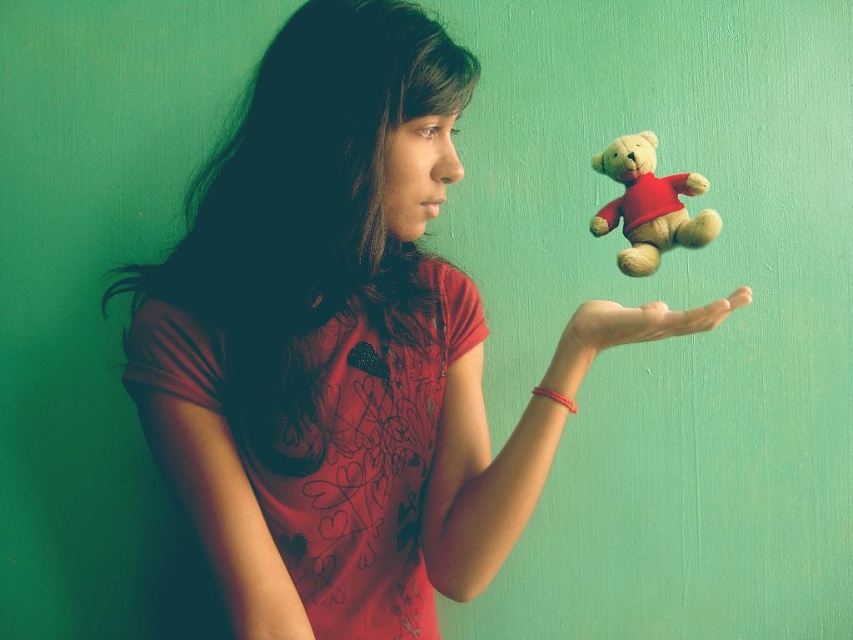
Between velvet beige teddy bear at center and matte skin hand at center, which one has less height?

matte skin hand at center is shorter.

Describe the element at coordinates (648, 205) in the screenshot. The height and width of the screenshot is (640, 853). I see `velvet beige teddy bear at center` at that location.

You are a GUI agent. You are given a task and a screenshot of the screen. Output one action in this format:
    pyautogui.click(x=<x>, y=<y>)
    Task: Click on the velvet beige teddy bear at center
    
    Given the screenshot: What is the action you would take?
    pyautogui.click(x=648, y=205)

Where is `velvet beige teddy bear at center`? velvet beige teddy bear at center is located at coordinates (648, 205).